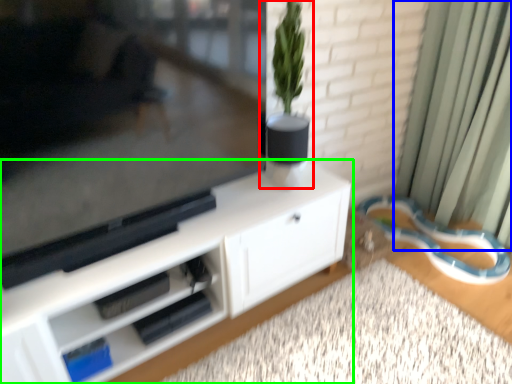
Question: Based on their relative distances, which object is farther from houseplant (highlighted by a red box)? Choose from curtain (highlighted by a blue box) and cabinetry (highlighted by a green box).

Choices:
 (A) curtain
 (B) cabinetry

Answer: (A)